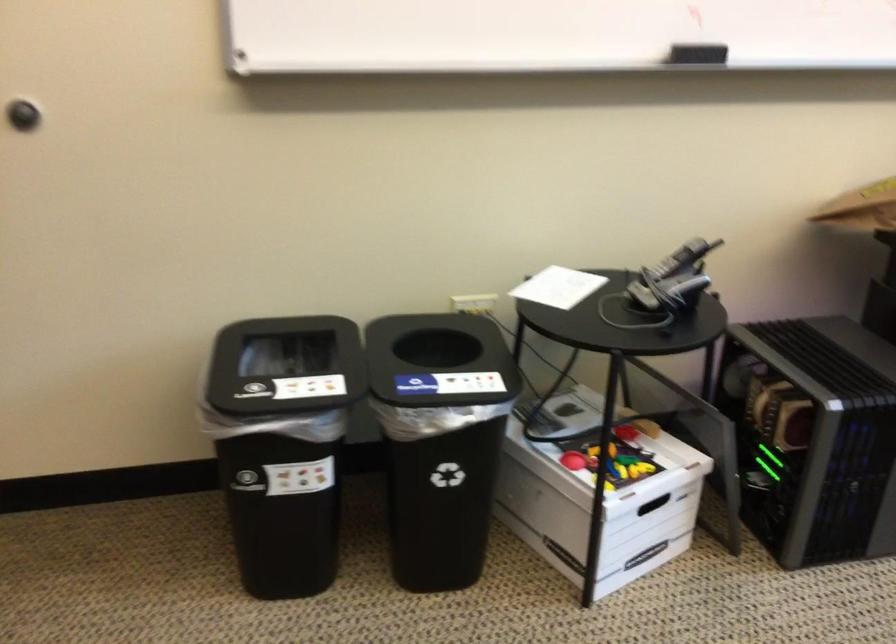
Where would you lift the white paper sheet? Please return your answer as a coordinate pair (x, y).

(558, 287)